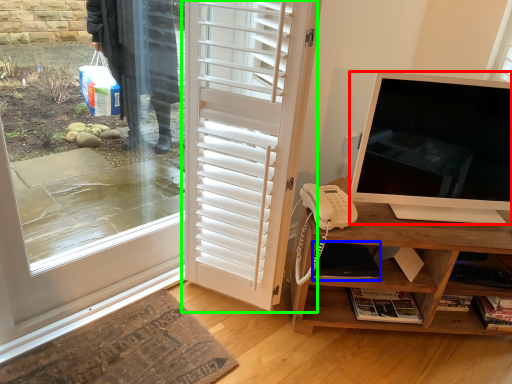
Question: Which object is the farthest from television (highlighted by a red box)? Choose among these: laptop (highlighted by a blue box) or door (highlighted by a green box).

Choices:
 (A) laptop
 (B) door

Answer: (B)